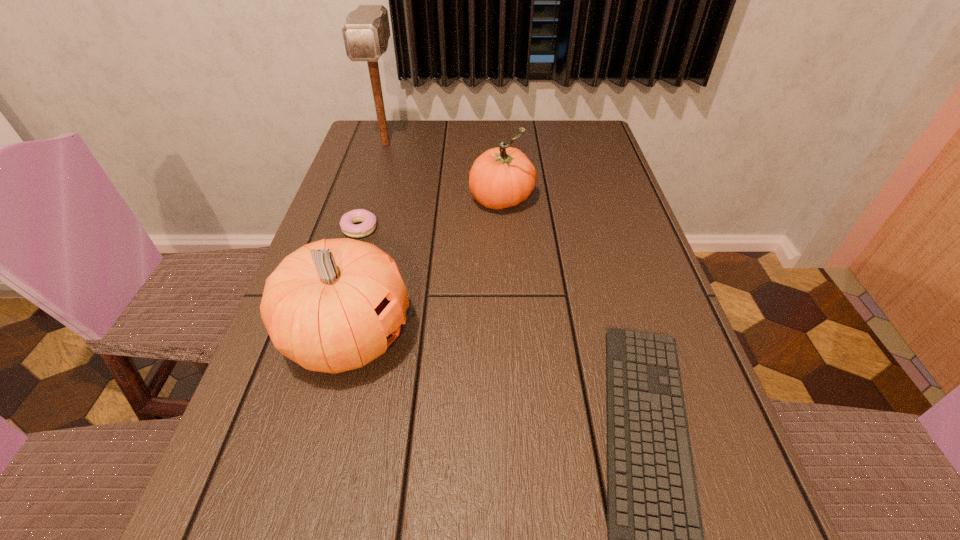
Find the location of a particular element. Image resolution: width=960 pixels, height=540 pixels. the tallest object is located at coordinates (366, 32).

Where is `mallet`? mallet is located at coordinates (366, 32).

Find the location of a particular element. The image size is (960, 540). the fourth object from left to right is located at coordinates (503, 177).

Find the location of a particular element. the right pumpkin is located at coordinates (503, 177).

Find the location of `the nearer pumpkin`. the nearer pumpkin is located at coordinates (334, 305).

Locate an element on the screen. Image resolution: width=960 pixels, height=540 pixels. the fourth tallest object is located at coordinates (347, 221).

This screenshot has height=540, width=960. Identify the location of free location located 0.100m on the striking face of the tallest object. (375, 179).

The image size is (960, 540). What are the coordinates of `blank area located on the right of the farther pumpkin` in the screenshot? It's located at (574, 200).

Where is `vacant area situated on the front-facing side of the left pumpkin`? The image size is (960, 540). vacant area situated on the front-facing side of the left pumpkin is located at coordinates (600, 338).

Where is `blank space located on the back of the second shortest object`? The height and width of the screenshot is (540, 960). blank space located on the back of the second shortest object is located at coordinates (383, 152).